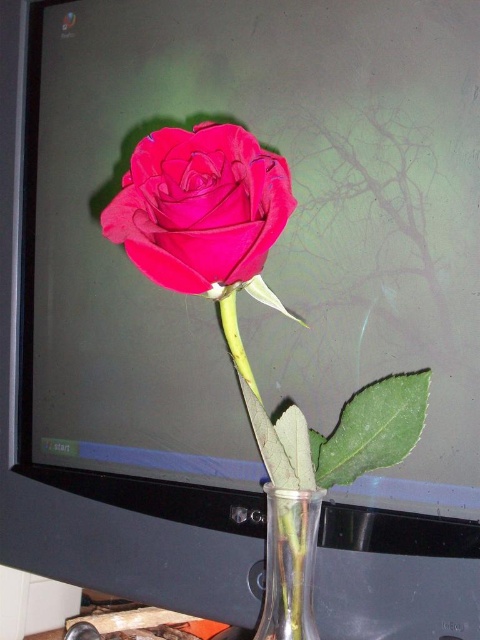
Is matte velvet rose at center bigger than transparent glass vase at lower center?

Yes.

You are a GUI agent. You are given a task and a screenshot of the screen. Output one action in this format:
    pyautogui.click(x=<x>, y=<y>)
    Task: Click on the matte velvet rose at center
    This screenshot has width=480, height=640.
    Given the screenshot: What is the action you would take?
    pyautogui.click(x=200, y=205)

The image size is (480, 640). Find the location of `matte velvet rose at center`. matte velvet rose at center is located at coordinates (200, 205).